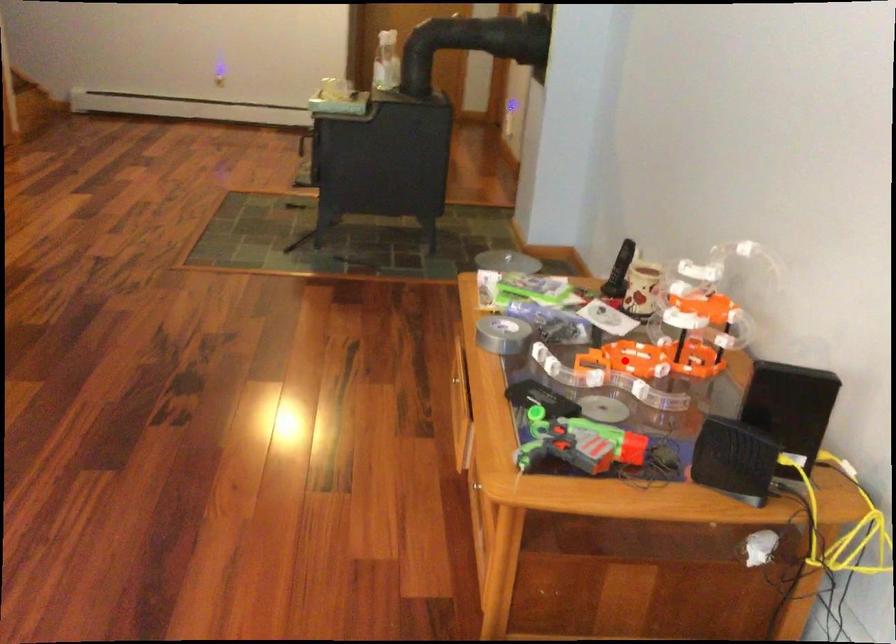
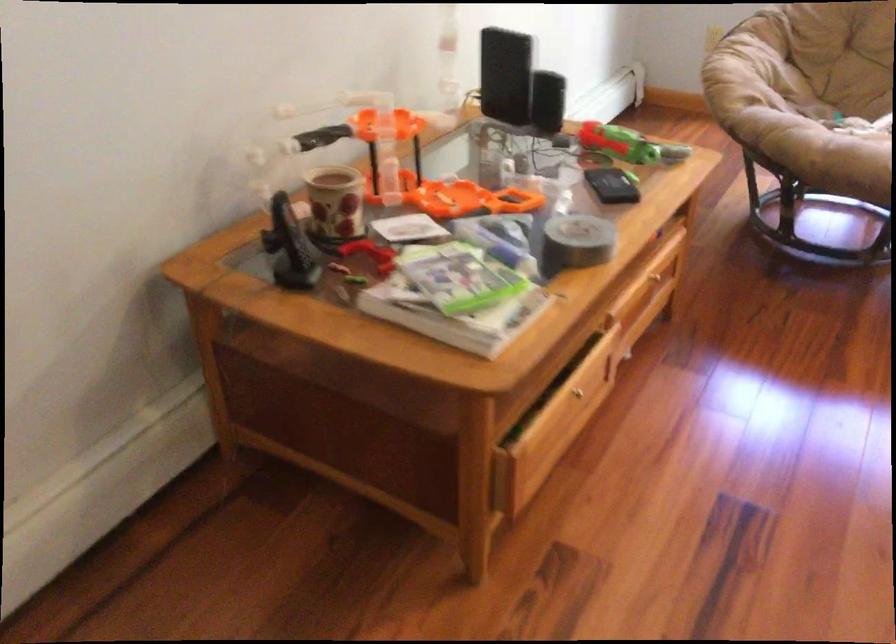
Where in the second image is the point corresponding to the highlighted location from the first image?

(470, 199)